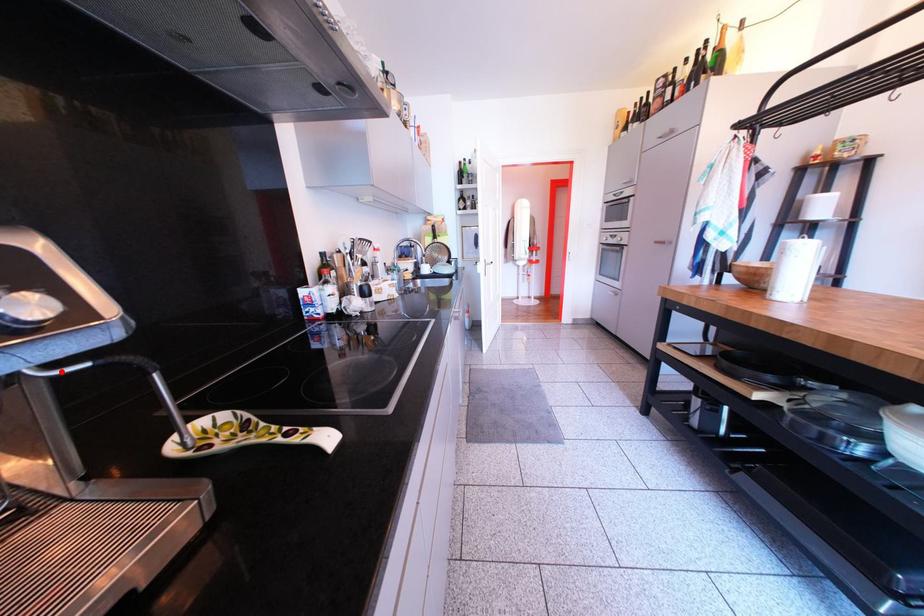
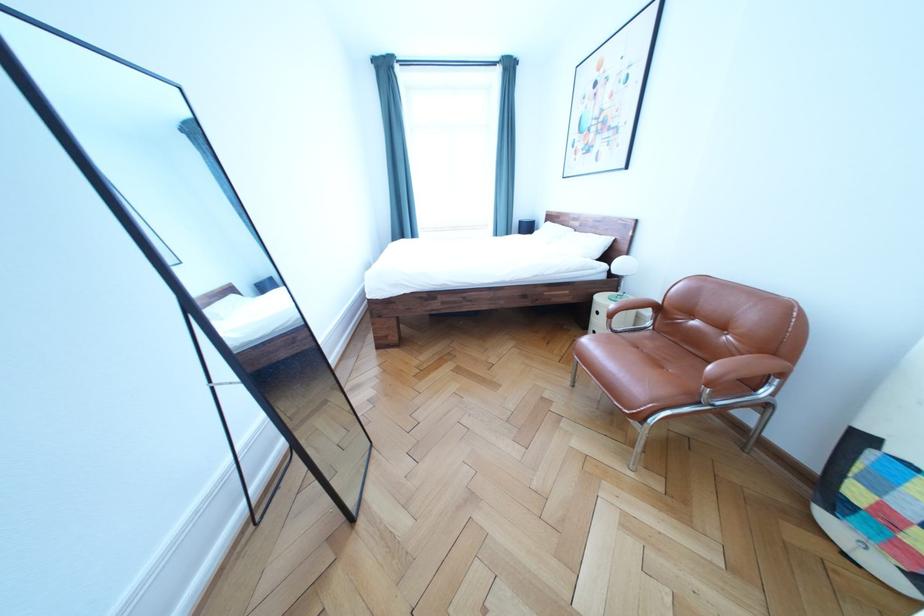
Question: I am providing you with two images of the same scene from different viewpoints. A red point is marked on the first image. Can you still see the location of the red point in image 2?

Choices:
 (A) Yes
 (B) No

Answer: (B)